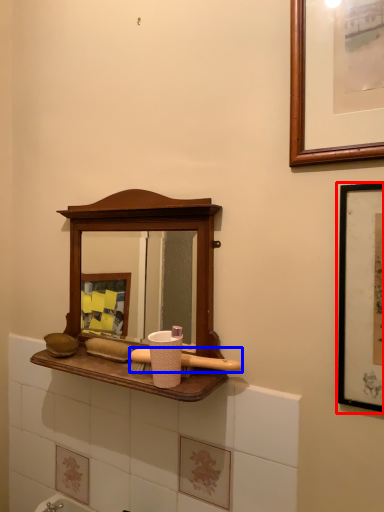
Question: Among these objects, which one is farthest to the camera, picture frame (highlighted by a red box) or brush (highlighted by a blue box)?

Choices:
 (A) picture frame
 (B) brush

Answer: (B)